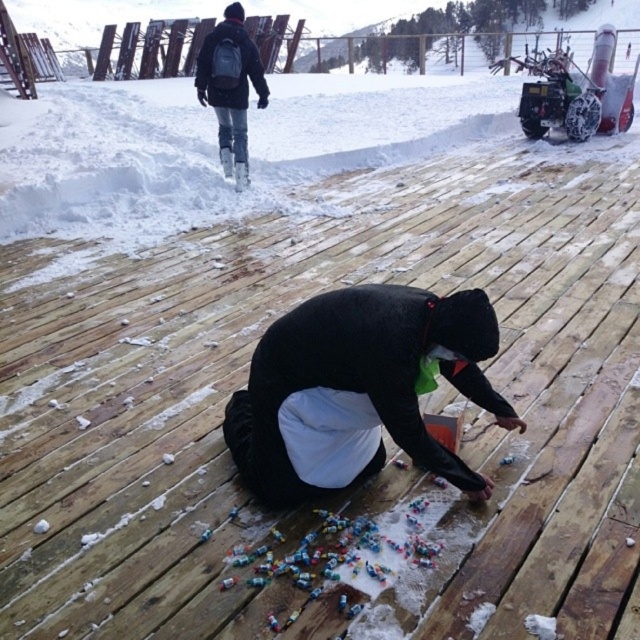
Question: Which object is farther from the camera taking this photo?

Choices:
 (A) black matte jacket at center
 (B) black backpack at upper left

Answer: (B)

Question: Can you confirm if black matte jacket at center is bigger than black backpack at upper left?

Choices:
 (A) yes
 (B) no

Answer: (B)

Question: Which point is closer to the camera?

Choices:
 (A) (381, 289)
 (B) (221, 22)

Answer: (A)

Question: Does black matte jacket at center appear under black backpack at upper left?

Choices:
 (A) no
 (B) yes

Answer: (B)

Question: Is black matte jacket at center to the left of black backpack at upper left from the viewer's perspective?

Choices:
 (A) no
 (B) yes

Answer: (A)